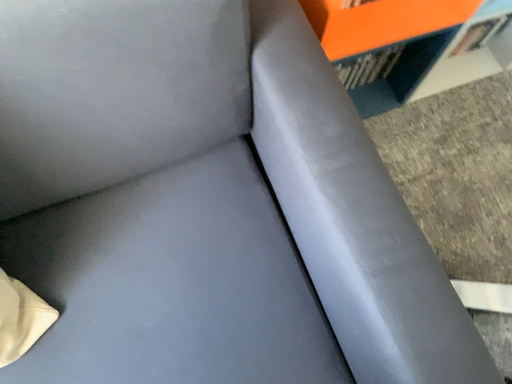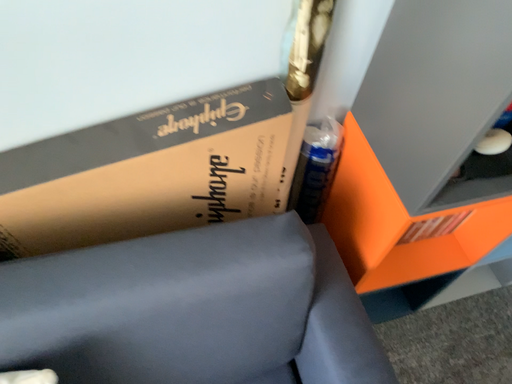
Question: Which way did the camera rotate in the video?

Choices:
 (A) rotated upward
 (B) rotated downward

Answer: (A)